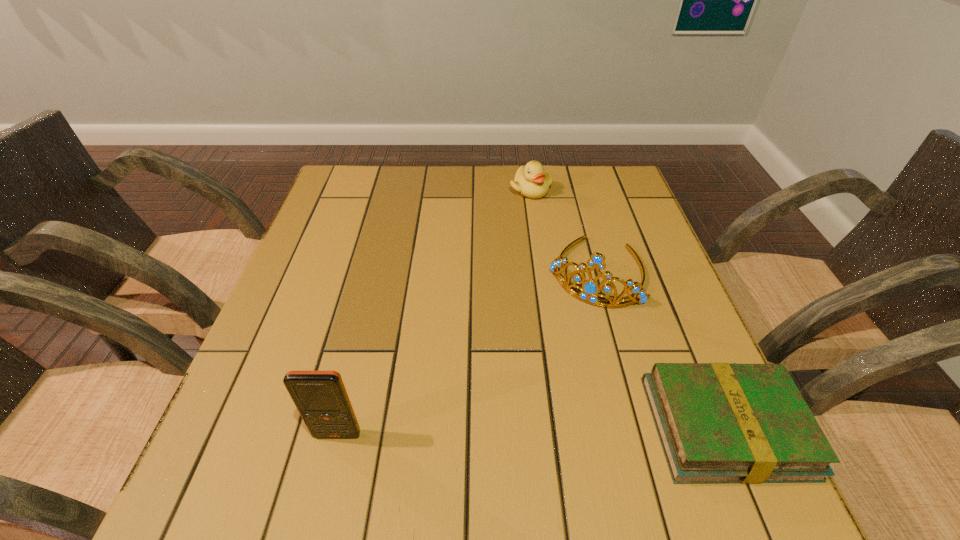
Find the location of `cellular telephone`. cellular telephone is located at coordinates (321, 398).

You are a GUI agent. You are given a task and a screenshot of the screen. Output one action in this format:
    pyautogui.click(x=<x>, y=<y>)
    Task: Click on the leftmost object
    
    Given the screenshot: What is the action you would take?
    pyautogui.click(x=321, y=398)

I want to click on book, so click(x=717, y=422).

You are a GUI agent. You are given a task and a screenshot of the screen. Output one action in this format:
    pyautogui.click(x=<x>, y=<y>)
    Task: Click on the tiara
    The image size is (960, 540).
    Given the screenshot: What is the action you would take?
    pyautogui.click(x=590, y=289)

Locate an element on the screen. This screenshot has height=540, width=960. the third shortest object is located at coordinates (590, 289).

Identify the location of duckling. The height and width of the screenshot is (540, 960). tap(531, 181).

Find the location of a particular element. The height and width of the screenshot is (540, 960). the second shortest object is located at coordinates (531, 181).

The height and width of the screenshot is (540, 960). In order to click on vacant region located on the back of the shortest object in this screenshot , I will do `click(648, 246)`.

The width and height of the screenshot is (960, 540). Identify the location of vacant point located on the front-facing side of the tiara. (552, 361).

Locate an element on the screen. free space located 0.290m on the front-facing side of the tiara is located at coordinates (526, 410).